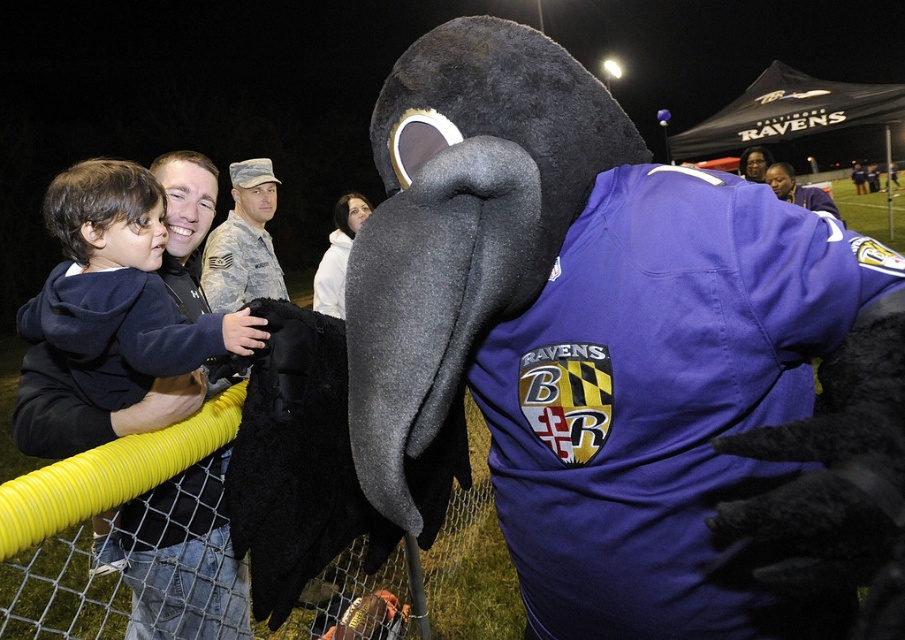
Question: Considering the relative positions of fuzzy black mascot at center and camouflage fabric uniform at center in the image provided, where is fuzzy black mascot at center located with respect to camouflage fabric uniform at center?

Choices:
 (A) below
 (B) above

Answer: (A)

Question: Can you confirm if fuzzy black mascot at center is positioned to the right of camouflage fabric uniform at center?

Choices:
 (A) no
 (B) yes

Answer: (B)

Question: In this image, where is dark blue hoodie at left located relative to camouflage fabric uniform at center?

Choices:
 (A) above
 (B) below

Answer: (B)

Question: Which of the following is the farthest from the observer?

Choices:
 (A) dark blue hoodie at left
 (B) camouflage fabric uniform at center

Answer: (B)

Question: Based on their relative distances, which object is nearer to the camouflage fabric uniform at center?

Choices:
 (A) dark blue hoodie at left
 (B) fuzzy black mascot at center

Answer: (A)

Question: Which of these objects is positioned farthest from the fuzzy black mascot at center?

Choices:
 (A) camouflage fabric uniform at center
 (B) dark blue hoodie at left

Answer: (A)